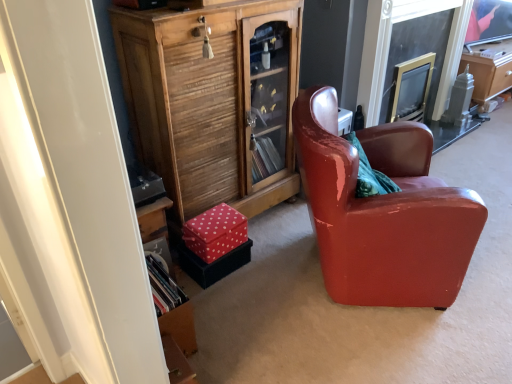
Measure the distance between point (393, 219) and camera.

They are 5.39 feet apart.

Image resolution: width=512 pixels, height=384 pixels. Describe the element at coordinates (383, 212) in the screenshot. I see `glossy leather armchair at center` at that location.

Image resolution: width=512 pixels, height=384 pixels. I want to click on glossy leather armchair at center, so click(383, 212).

What is the approximate height of glossy leather armchair at center?

The height of glossy leather armchair at center is 33.59 inches.

Where is `wooden cabinet at lower left`? wooden cabinet at lower left is located at coordinates (213, 102).

This screenshot has width=512, height=384. Describe the element at coordinates (213, 102) in the screenshot. I see `wooden cabinet at lower left` at that location.

Where is `glossy leather armchair at center`? Image resolution: width=512 pixels, height=384 pixels. glossy leather armchair at center is located at coordinates (383, 212).

Consider the image. Considering the positions of objects glossy leather armchair at center and wooden cabinet at lower left in the image provided, who is more to the right, glossy leather armchair at center or wooden cabinet at lower left?

Positioned to the right is glossy leather armchair at center.

Based on the photo, is the position of glossy leather armchair at center less distant than that of wooden cabinet at lower left?

Yes, glossy leather armchair at center is closer to the camera.

Is point (321, 225) positioned after point (167, 159)?

No.

From the image's perspective, is glossy leather armchair at center over wooden cabinet at lower left?

Actually, glossy leather armchair at center appears below wooden cabinet at lower left in the image.

From a real-world perspective, does glossy leather armchair at center sit lower than wooden cabinet at lower left?

Yes, from a real-world perspective, glossy leather armchair at center is under wooden cabinet at lower left.

Which of these two, glossy leather armchair at center or wooden cabinet at lower left, is thinner?

Thinner between the two is wooden cabinet at lower left.

Which of these two, glossy leather armchair at center or wooden cabinet at lower left, stands shorter?

With less height is glossy leather armchair at center.

Can you confirm if glossy leather armchair at center is bigger than wooden cabinet at lower left?

Correct, glossy leather armchair at center is larger in size than wooden cabinet at lower left.

Is wooden cabinet at lower left located within glossy leather armchair at center?

No, wooden cabinet at lower left is located outside of glossy leather armchair at center.

Is there a large distance between glossy leather armchair at center and wooden cabinet at lower left?

Actually, glossy leather armchair at center and wooden cabinet at lower left are a little close together.

Is glossy leather armchair at center looking in the opposite direction of wooden cabinet at lower left?

That's right, glossy leather armchair at center is facing away from wooden cabinet at lower left.

How many degrees apart are the facing directions of glossy leather armchair at center and wooden cabinet at lower left?

49.1 degrees.

This screenshot has height=384, width=512. Find the location of `cabinetry to the left of glossy leather armchair at center`. cabinetry to the left of glossy leather armchair at center is located at coordinates (213, 102).

Considering the positions of objects wooden cabinet at lower left and glossy leather armchair at center in the image provided, who is more to the right, wooden cabinet at lower left or glossy leather armchair at center?

From the viewer's perspective, glossy leather armchair at center appears more on the right side.

Does wooden cabinet at lower left lie in front of glossy leather armchair at center?

No.

Is point (196, 201) positioned after point (428, 142)?

No, it is not.

From the image's perspective, is wooden cabinet at lower left above or below glossy leather armchair at center?

Based on their image positions, wooden cabinet at lower left is located above glossy leather armchair at center.

From a real-world perspective, is wooden cabinet at lower left physically located above or below glossy leather armchair at center?

In terms of real-world spatial position, wooden cabinet at lower left is above glossy leather armchair at center.

Considering the relative sizes of wooden cabinet at lower left and glossy leather armchair at center in the image provided, is wooden cabinet at lower left wider than glossy leather armchair at center?

No, wooden cabinet at lower left is not wider than glossy leather armchair at center.

Who is shorter, wooden cabinet at lower left or glossy leather armchair at center?

With less height is glossy leather armchair at center.

Considering the relative sizes of wooden cabinet at lower left and glossy leather armchair at center in the image provided, is wooden cabinet at lower left smaller than glossy leather armchair at center?

Indeed, wooden cabinet at lower left has a smaller size compared to glossy leather armchair at center.

Is wooden cabinet at lower left positioned beyond the bounds of glossy leather armchair at center?

Indeed, wooden cabinet at lower left is completely outside glossy leather armchair at center.

Based on the photo, is wooden cabinet at lower left placed right next to glossy leather armchair at center?

There is a gap between wooden cabinet at lower left and glossy leather armchair at center.

Is wooden cabinet at lower left oriented towards glossy leather armchair at center?

Yes, wooden cabinet at lower left is oriented towards glossy leather armchair at center.

How different are the orientations of wooden cabinet at lower left and glossy leather armchair at center in degrees?

49.1 degrees separate the facing orientations of wooden cabinet at lower left and glossy leather armchair at center.

Where is `cabinetry behind the glossy leather armchair at center`? This screenshot has width=512, height=384. cabinetry behind the glossy leather armchair at center is located at coordinates (213, 102).

Locate an element on the screen. Image resolution: width=512 pixels, height=384 pixels. cabinetry on the left of glossy leather armchair at center is located at coordinates (213, 102).

At what (x,y) coordinates should I click in order to perform the action: click on cabinetry that is above the glossy leather armchair at center (from a real-world perspective). Please return your answer as a coordinate pair (x, y). This screenshot has width=512, height=384. Looking at the image, I should click on (213, 102).